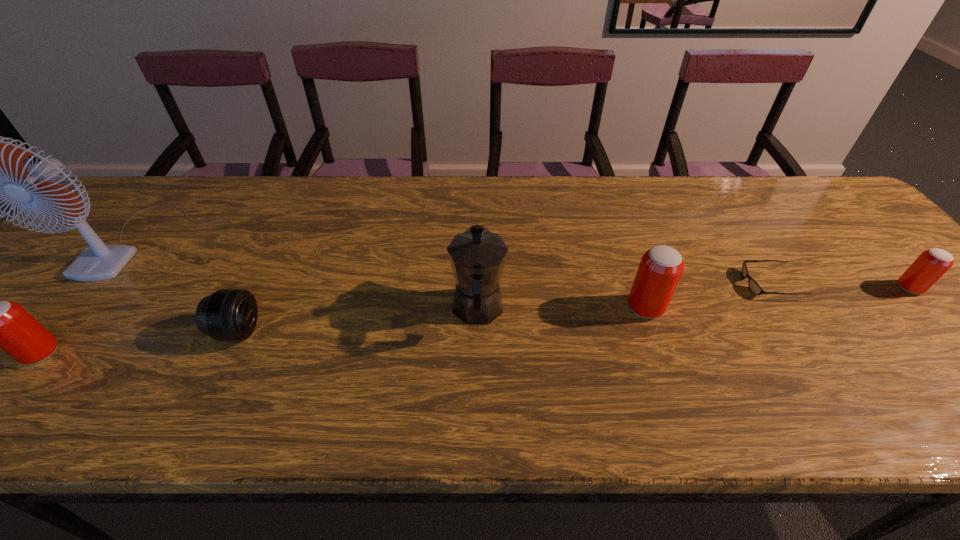
Identify the location of blank area in the image that satisfies the following two spatial constraints: 1. on the front-facing side of the rightmost beer can; 2. on the right side of the tallest object. The height and width of the screenshot is (540, 960). (107, 288).

Find the location of `vacant space that satisfies the following two spatial constraints: 1. on the front-facing side of the shortest beer can; 2. on the right side of the second object from right to left`. vacant space that satisfies the following two spatial constraints: 1. on the front-facing side of the shortest beer can; 2. on the right side of the second object from right to left is located at coordinates tap(772, 288).

At what (x,y) coordinates should I click in order to perform the action: click on free space that satisfies the following two spatial constraints: 1. on the front-facing side of the fan; 2. on the right side of the rightmost object. Please return your answer as a coordinate pair (x, y). This screenshot has width=960, height=540. Looking at the image, I should click on (107, 288).

This screenshot has height=540, width=960. In order to click on vacant space that satisfies the following two spatial constraints: 1. on the pouring side of the rightmost object; 2. on the left side of the second tallest object in this screenshot , I will do `click(478, 288)`.

In order to click on free region that satisfies the following two spatial constraints: 1. on the pouring side of the sixth shortest object; 2. on the left side of the rightmost beer can in this screenshot , I will do `click(478, 288)`.

I want to click on free region that satisfies the following two spatial constraints: 1. on the pouring side of the fourth object from right to left; 2. on the left side of the tallest beer can, so click(x=478, y=308).

Locate an element on the screen. The height and width of the screenshot is (540, 960). vacant region that satisfies the following two spatial constraints: 1. on the front-facing side of the shortest object; 2. on the right side of the rightmost object is located at coordinates (772, 288).